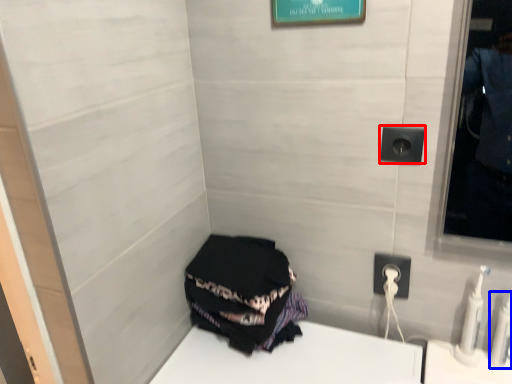
Question: Which point is closer to the camera, electric outlet (highlighted by a red box) or toiletry (highlighted by a blue box)?

Choices:
 (A) electric outlet
 (B) toiletry

Answer: (B)